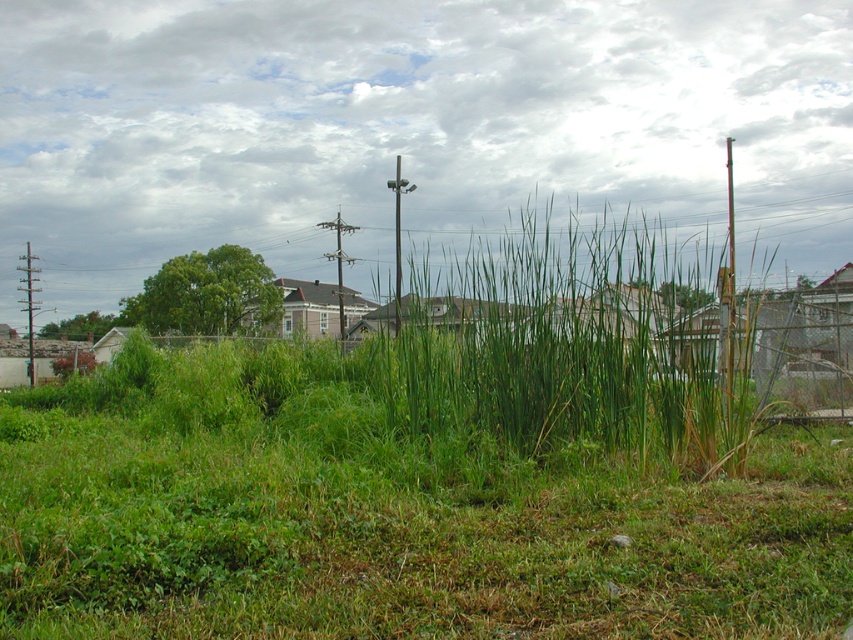
Describe the element at coordinates (398, 236) in the screenshot. The height and width of the screenshot is (640, 853). I see `metallic gray pole at center` at that location.

The width and height of the screenshot is (853, 640). Describe the element at coordinates (398, 236) in the screenshot. I see `metallic gray pole at center` at that location.

The image size is (853, 640). Find the location of `metallic gray pole at center`. metallic gray pole at center is located at coordinates (398, 236).

Who is more distant from viewer, (28, 257) or (337, 221)?

Point (28, 257)

Is point (32, 358) closer to camera compared to point (350, 227)?

No.

Locate an element on the screen. metallic gray telegraph pole at left is located at coordinates (28, 305).

Is metallic gray telegraph pole at left wider than metallic gray pole at center?

Indeed, metallic gray telegraph pole at left has a greater width compared to metallic gray pole at center.

Is point (32, 276) positioned before point (396, 241)?

That is True.

Is point (28, 273) farther from viewer compared to point (396, 237)?

No, it is in front of (396, 237).

This screenshot has width=853, height=640. Find the location of `metallic gray telegraph pole at left`. metallic gray telegraph pole at left is located at coordinates (28, 305).